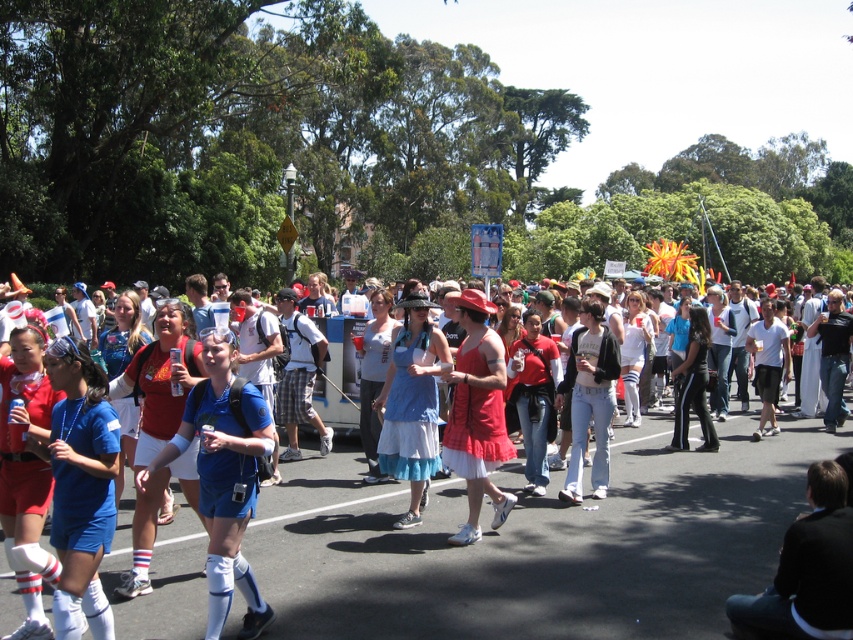
You are standing at the point marked as point (231, 477) in the image. If you walk straight ahead, will you be facing towards or away from the vendor stand?

The point (231, 477) is 15.39 feet away from the viewer. Since the vendor stand is in the midground, walking straight ahead from the point would take you towards the vendor stand.

You are a photographer trying to capture a candid shot of the two dresses in the scene. The camera you are using has a minimum focus distance of 18 inches. Can you take a photo of both the matte red dress at center and the blue cotton dress at center without moving either of them?

The matte red dress at center is 18.81 inches from the blue cotton dress at center. Since your camera requires a minimum focus distance of 18 inches, you can take the photo as the distance between them is sufficient.

You are standing at the point with coordinates point (422, 316) and want to walk towards the point with coordinates point (543, 563). Which direction should you face to walk directly towards your destination?

You should face towards the direction of point (543, 563), which is in front of point (422, 316), so you need to walk forward towards it.